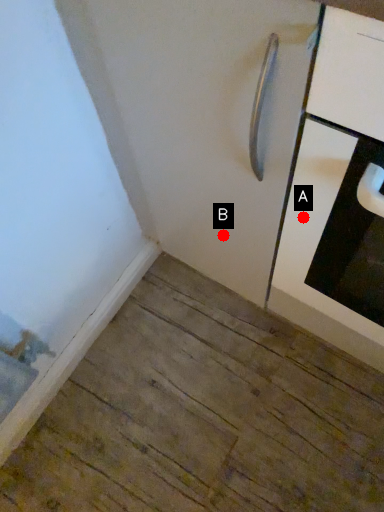
Question: Two points are circled on the image, labeled by A and B beside each circle. Among these points, which one is nearest to the camera?

Choices:
 (A) A is closer
 (B) B is closer

Answer: (A)